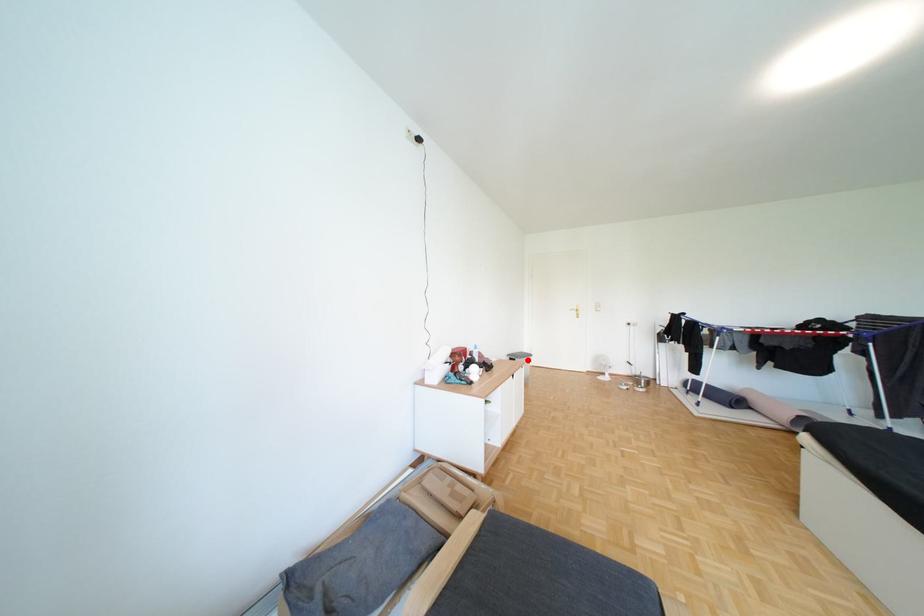
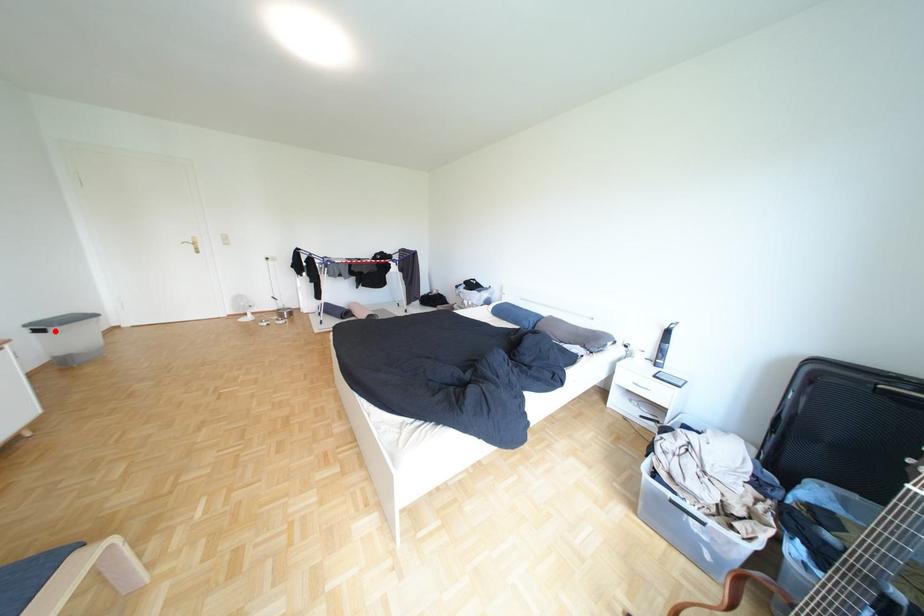
I am providing you with two images of the same scene from different viewpoints. A red point is marked on the first image and another point is marked on the second image. Are the points marked in image1 and image2 representing the same 3D position?

Yes